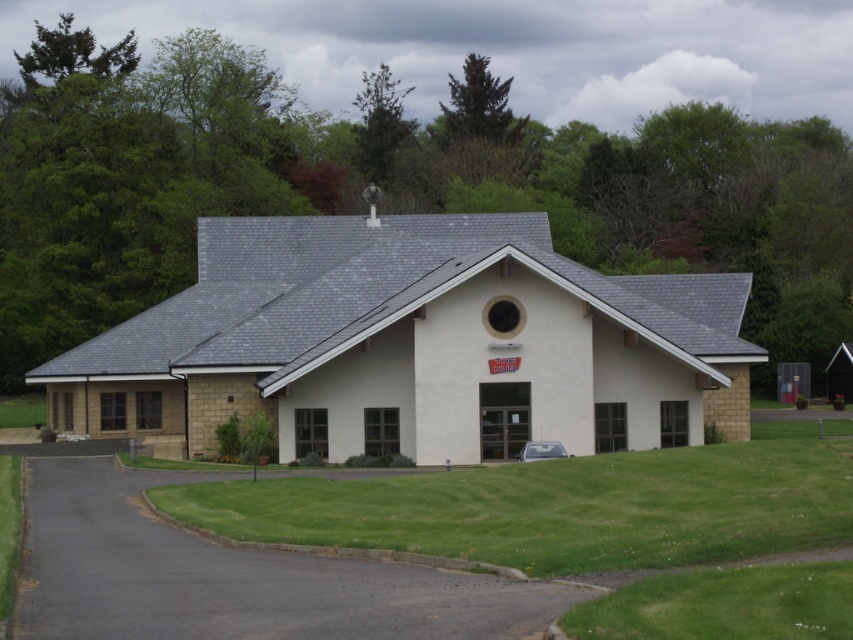
Which is more to the right, white smooth chapel at center or green grass at center?

From the viewer's perspective, green grass at center appears more on the right side.

Which is in front, point (190, 451) or point (566, 467)?

Point (566, 467)

Which is behind, point (556, 378) or point (547, 570)?

Point (556, 378)

This screenshot has width=853, height=640. I want to click on white smooth chapel at center, so click(415, 344).

Who is taller, green grass at center or black asphalt driveway at lower left?

black asphalt driveway at lower left

Does point (582, 468) lie in front of point (106, 529)?

Yes, it is in front of point (106, 529).

Locate an element on the screen. This screenshot has width=853, height=640. green grass at center is located at coordinates (564, 506).

I want to click on green grass at center, so click(564, 506).

Does white smooth chapel at center have a smaller size compared to black asphalt driveway at lower left?

Actually, white smooth chapel at center might be larger than black asphalt driveway at lower left.

Is white smooth chapel at center above black asphalt driveway at lower left?

Yes, white smooth chapel at center is above black asphalt driveway at lower left.

You are a GUI agent. You are given a task and a screenshot of the screen. Output one action in this format:
    pyautogui.click(x=<x>, y=<y>)
    Task: Click on the white smooth chapel at center
    
    Given the screenshot: What is the action you would take?
    pyautogui.click(x=415, y=344)

In order to click on white smooth chapel at center in this screenshot , I will do `click(415, 344)`.